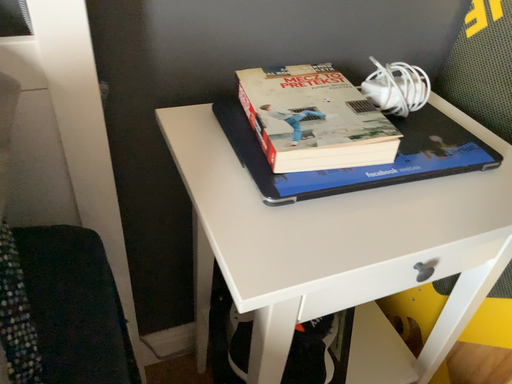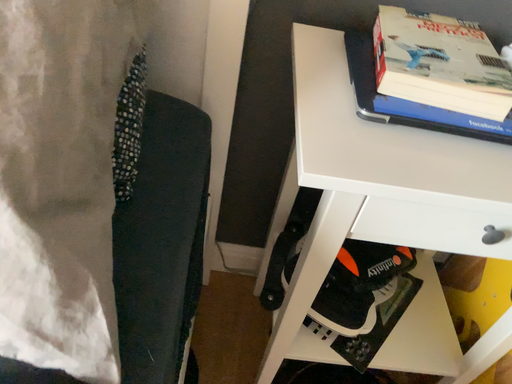
Question: How did the camera likely rotate when shooting the video?

Choices:
 (A) rotated left
 (B) rotated right

Answer: (A)